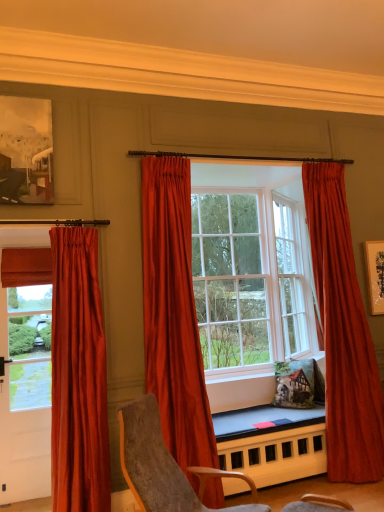
Where is `empty space that is ontop of smooth wooden table at center`? This screenshot has height=512, width=384. empty space that is ontop of smooth wooden table at center is located at coordinates (274, 415).